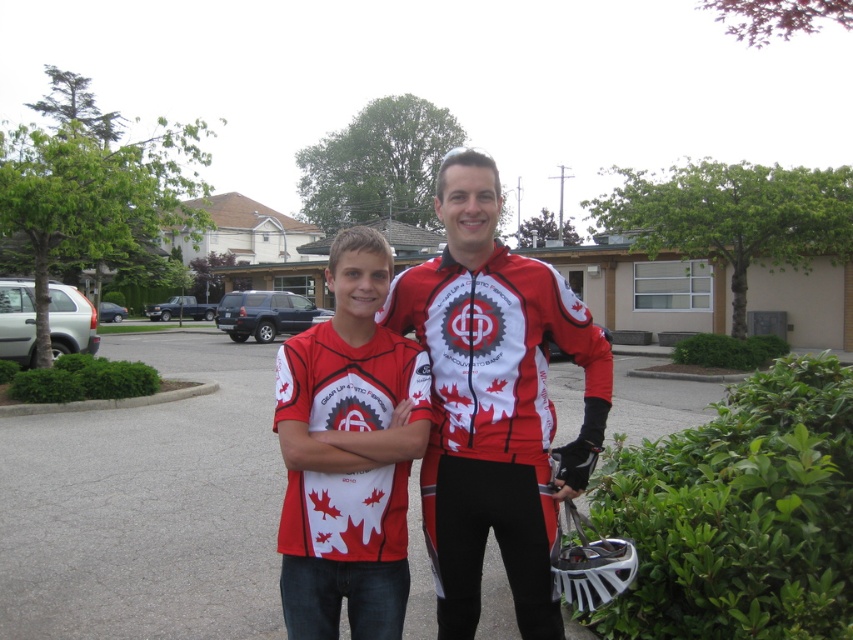
Between point (430, 477) and point (346, 228), which one is positioned behind?

Point (346, 228)

Locate an element on the screen. The height and width of the screenshot is (640, 853). matte red cycling jersey at center is located at coordinates (494, 403).